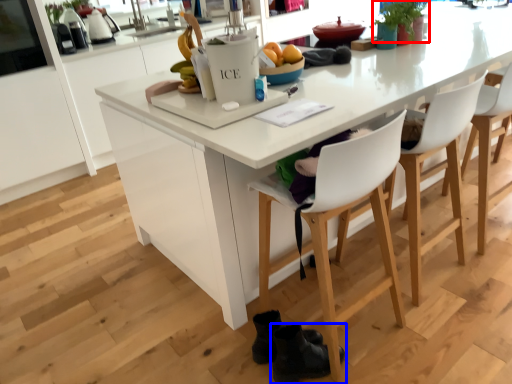
Question: Which point is closer to the camera, plant (highlighted by a red box) or footwear (highlighted by a blue box)?

Choices:
 (A) plant
 (B) footwear

Answer: (B)